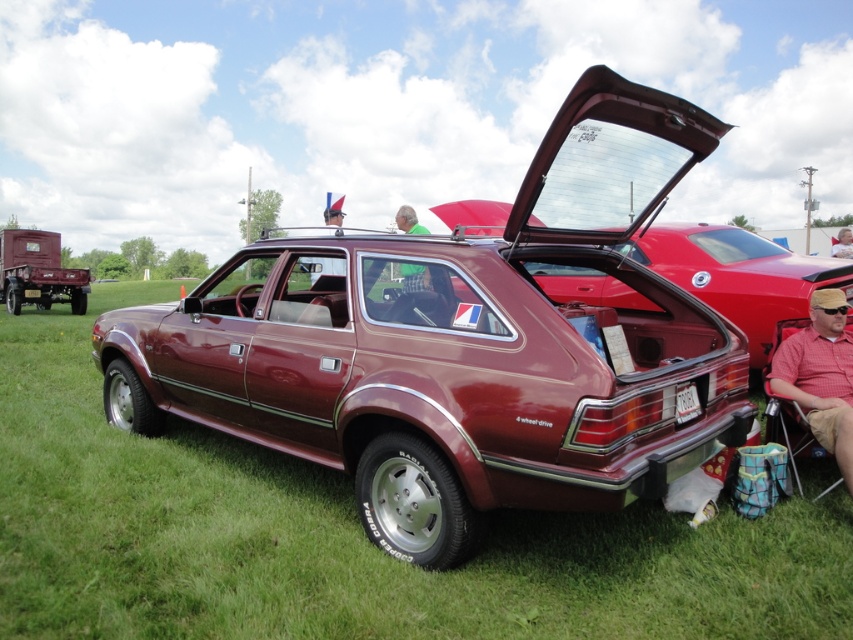
Between point (144, 307) and point (778, 387), which one is positioned in front?

Point (778, 387)

Is point (590, 481) farther from camera compared to point (775, 369)?

That is False.

What do you see at coordinates (462, 346) in the screenshot? The height and width of the screenshot is (640, 853). I see `maroon metallic hatchback at center` at bounding box center [462, 346].

This screenshot has width=853, height=640. I want to click on maroon metallic hatchback at center, so click(x=462, y=346).

Does maroon metallic hatchback at center have a greater width compared to maroon matte hatchback at center?

Yes, maroon metallic hatchback at center is wider than maroon matte hatchback at center.

Is point (582, 141) positioned in front of point (735, 301)?

Yes.

You are a GUI agent. You are given a task and a screenshot of the screen. Output one action in this format:
    pyautogui.click(x=<x>, y=<y>)
    Task: Click on the maroon metallic hatchback at center
    This screenshot has width=853, height=640.
    Given the screenshot: What is the action you would take?
    pyautogui.click(x=462, y=346)

Who is more forward, (791, 380) or (425, 230)?

Point (791, 380) is more forward.

Who is more distant from viewer, [833,378] or [404,280]?

Point [833,378]

This screenshot has width=853, height=640. Identify the location of red plaid shirt at lower right. click(821, 376).